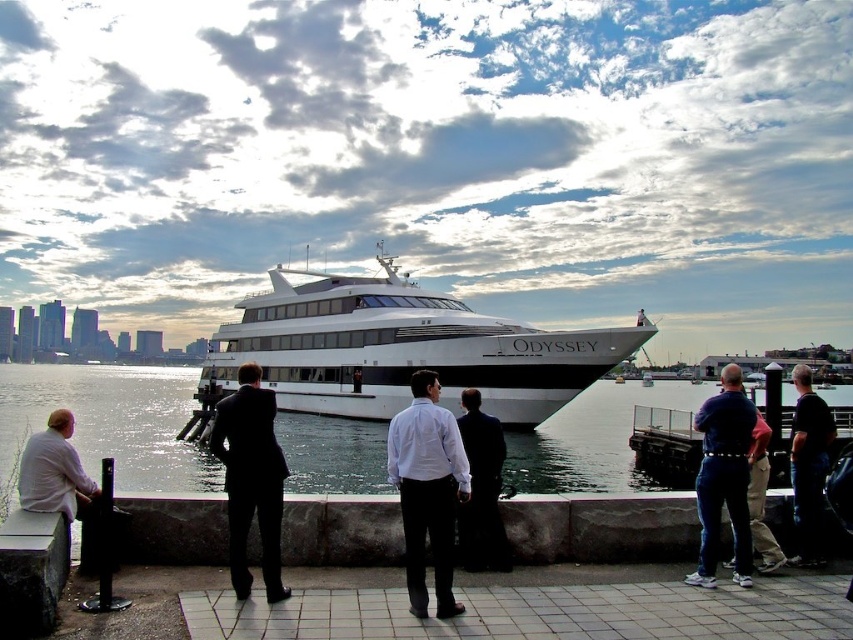
Which is in front, point (518, 385) or point (677, 390)?

Positioned in front is point (518, 385).

Is white glossy cruise ship at center below clear water at center?

Actually, white glossy cruise ship at center is above clear water at center.

Identify the location of white glossy cruise ship at center. The image size is (853, 640). (401, 349).

Locate an element on the screen. The height and width of the screenshot is (640, 853). white glossy cruise ship at center is located at coordinates (401, 349).

From the picture: Which is below, white glossy cruise ship at center or white shirt at left?

white shirt at left

Is point (285, 284) closer to camera compared to point (41, 500)?

No, (285, 284) is behind (41, 500).

You are a GUI agent. You are given a task and a screenshot of the screen. Output one action in this format:
    pyautogui.click(x=<x>, y=<y>)
    Task: Click on the white glossy cruise ship at center
    
    Given the screenshot: What is the action you would take?
    pyautogui.click(x=401, y=349)

Where is `white glossy cruise ship at center`? The image size is (853, 640). white glossy cruise ship at center is located at coordinates click(x=401, y=349).

Which of these two, white smooth shirt at center or black suit at center, stands taller?

Standing taller between the two is black suit at center.

Which is in front, point (431, 422) or point (224, 422)?

Point (431, 422) is in front.

At what (x,y) coordinates should I click in order to perform the action: click on white smooth shirt at center. Please return your answer as a coordinate pair (x, y). Looking at the image, I should click on (427, 490).